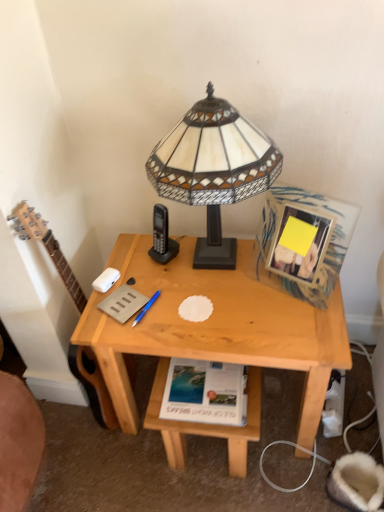
Where is `free space above white paper at lower center, marked as the 2th paperback book in a top-to-bottom arrangement (from a real-world perspective)`? free space above white paper at lower center, marked as the 2th paperback book in a top-to-bottom arrangement (from a real-world perspective) is located at coordinates pyautogui.click(x=212, y=382).